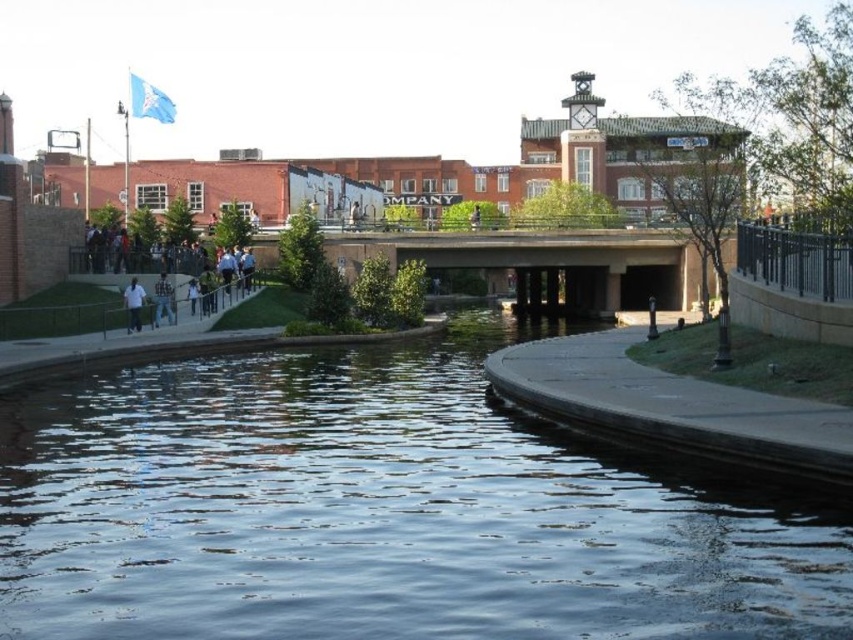
Is smooth concrete path at lower right below white cotton shirt at center?

Indeed, smooth concrete path at lower right is positioned under white cotton shirt at center.

Can you confirm if smooth concrete path at lower right is thinner than white cotton shirt at center?

No.

This screenshot has height=640, width=853. What do you see at coordinates (668, 404) in the screenshot?
I see `smooth concrete path at lower right` at bounding box center [668, 404].

Locate an element on the screen. The width and height of the screenshot is (853, 640). smooth concrete path at lower right is located at coordinates (668, 404).

Identify the location of clear water at center. (380, 513).

Is clear water at center smaller than white matte shirt at lower left?

No, clear water at center is not smaller than white matte shirt at lower left.

Find the location of a particular element. Image resolution: width=853 pixels, height=640 pixels. clear water at center is located at coordinates (380, 513).

Between point (590, 572) and point (170, 301), which one is positioned behind?

The point (170, 301) is behind.

Who is lower down, clear water at center or white cotton shirt at center?

clear water at center

Does point (136, 419) lie behind point (165, 275)?

No, it is in front of (165, 275).

This screenshot has width=853, height=640. I want to click on clear water at center, so click(x=380, y=513).